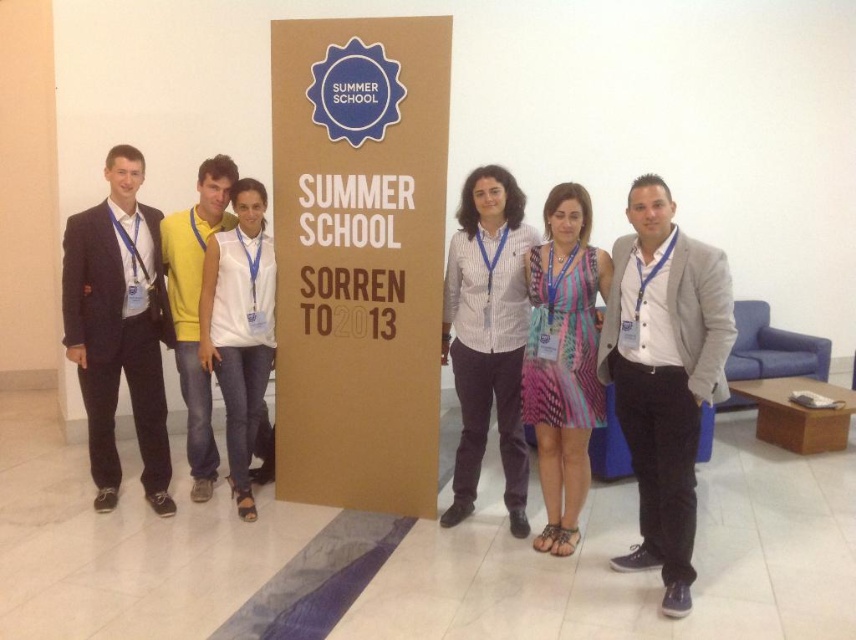
In the scene shown: You are organizing a group photo and need to arrange the participants based on their clothing sizes. The black suit at left and the striped fabric dress at center are two of the outfits present. Which outfit should be placed in a position that requires a larger space?

The black suit at left should be placed in the position requiring larger space since it is larger in size than the striped fabric dress at center.